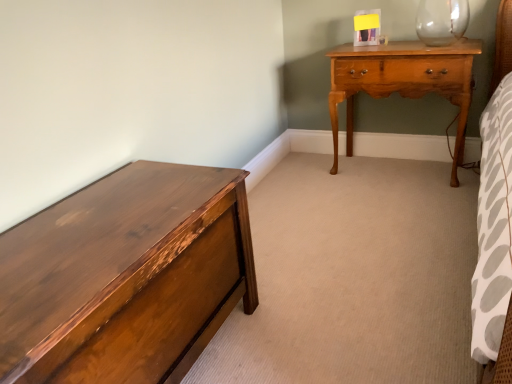
Image resolution: width=512 pixels, height=384 pixels. I want to click on free space above shiny brown wood chest of drawers at left (from a real-world perspective), so click(x=93, y=230).